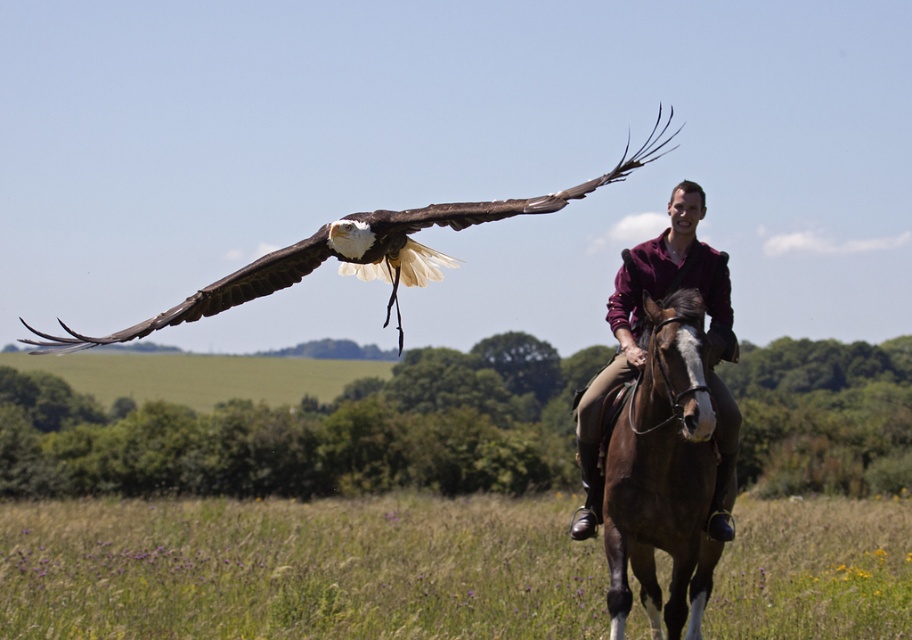
Question: Is brown feathered eagle at upper left to the right of maroon shirt at center from the viewer's perspective?

Choices:
 (A) yes
 (B) no

Answer: (A)

Question: Is brown glossy horse at center above maroon shirt at center?

Choices:
 (A) yes
 (B) no

Answer: (B)

Question: Which point is closer to the camera taking this photo?

Choices:
 (A) (657, 292)
 (B) (382, 225)

Answer: (A)

Question: Which object is the farthest from the maroon shirt at center?

Choices:
 (A) brown feathered eagle at upper left
 (B) brown glossy horse at center

Answer: (A)

Question: Estimate the real-world distances between objects in this image. Which object is farther from the brown feathered eagle at upper left?

Choices:
 (A) maroon shirt at center
 (B) brown glossy horse at center

Answer: (B)

Question: Can you confirm if brown glossy horse at center is positioned to the right of brown feathered eagle at upper left?

Choices:
 (A) yes
 (B) no

Answer: (B)